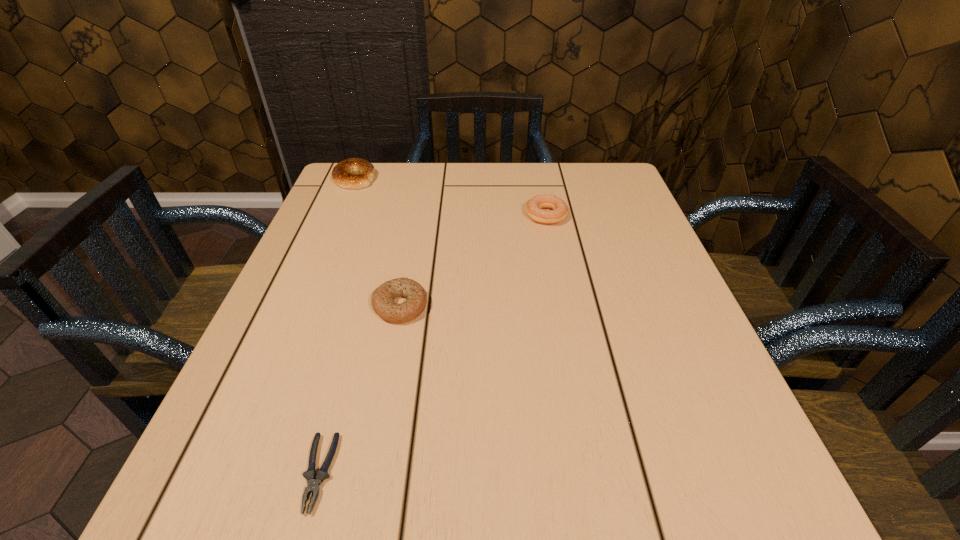
Identify the location of free space located 0.230m on the right of the nearest bagel. (546, 305).

What are the coordinates of `object present at the near edge` in the screenshot? It's located at (313, 485).

Where is `bagel located in the left edge section of the desktop`? bagel located in the left edge section of the desktop is located at coordinates (343, 174).

Locate an element on the screen. The image size is (960, 540). pliers present at the left edge is located at coordinates (313, 485).

At what (x,y) coordinates should I click in order to perform the action: click on object at the far left corner. Please return your answer as a coordinate pair (x, y). Looking at the image, I should click on (343, 174).

Image resolution: width=960 pixels, height=540 pixels. I want to click on object that is at the near left corner, so click(313, 485).

You are a GUI agent. You are given a task and a screenshot of the screen. Output one action in this format:
    pyautogui.click(x=<x>, y=<y>)
    Task: Click on the vacant area at the far edge of the desktop
    
    Given the screenshot: What is the action you would take?
    pyautogui.click(x=554, y=188)

Image resolution: width=960 pixels, height=540 pixels. In order to click on free space at the left edge of the desktop in this screenshot , I will do `click(299, 288)`.

Where is `free space at the right edge`? Image resolution: width=960 pixels, height=540 pixels. free space at the right edge is located at coordinates (586, 221).

The width and height of the screenshot is (960, 540). Find the location of `free spot at the far left corner of the desktop`. free spot at the far left corner of the desktop is located at coordinates (381, 187).